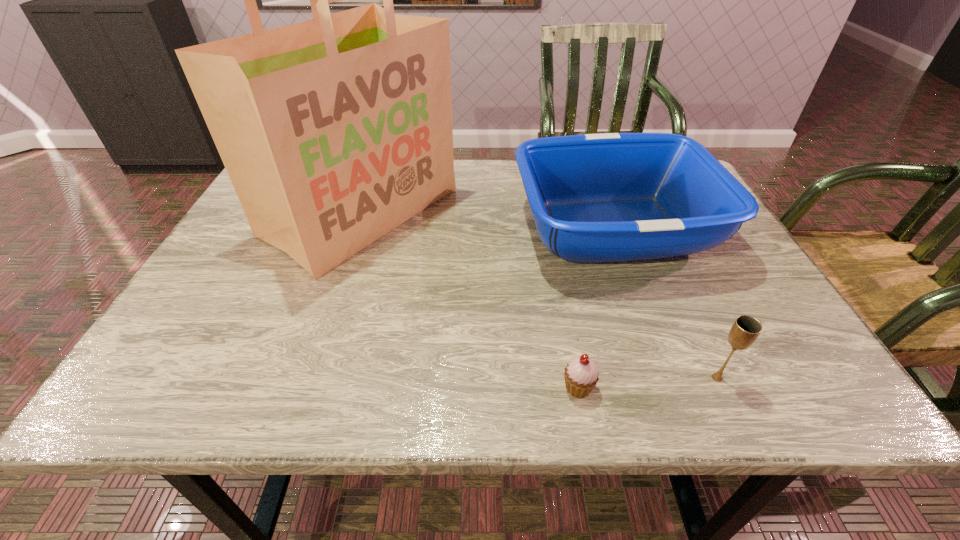
Where is `the tallest object`? The height and width of the screenshot is (540, 960). the tallest object is located at coordinates (334, 131).

At what (x,y) coordinates should I click in order to perform the action: click on the leftmost object. Please return your answer as a coordinate pair (x, y). Looking at the image, I should click on (334, 131).

Find the location of `tray`. tray is located at coordinates (614, 197).

Find the location of a particular element. The height and width of the screenshot is (540, 960). chalice is located at coordinates (744, 332).

Locate an element on the screen. cupcake is located at coordinates (581, 375).

Where is `free space located 0.150m on the front of the tallest object`? free space located 0.150m on the front of the tallest object is located at coordinates (322, 334).

The width and height of the screenshot is (960, 540). What are the coordinates of `free spot located 0.110m on the front of the tray` in the screenshot? It's located at (649, 328).

The image size is (960, 540). I want to click on free space located 0.300m on the left of the chalice, so click(x=537, y=378).

Identify the location of blank area located 0.120m on the right of the shortest object. The width and height of the screenshot is (960, 540). (664, 388).

Find the location of a particular element. grocery bag that is at the far edge is located at coordinates (334, 131).